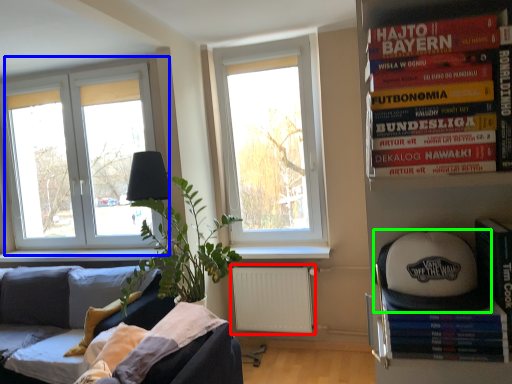
Question: Which is farther away from radiator (highlighted by a red box)? window (highlighted by a blue box) or baseball hat (highlighted by a green box)?

Choices:
 (A) window
 (B) baseball hat

Answer: (B)